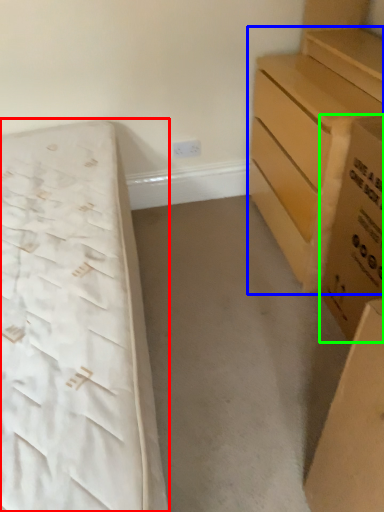
Question: Which object is the farthest from bed (highlighted by a red box)? Choose among these: chest of drawers (highlighted by a blue box) or cardboard box (highlighted by a green box).

Choices:
 (A) chest of drawers
 (B) cardboard box

Answer: (B)